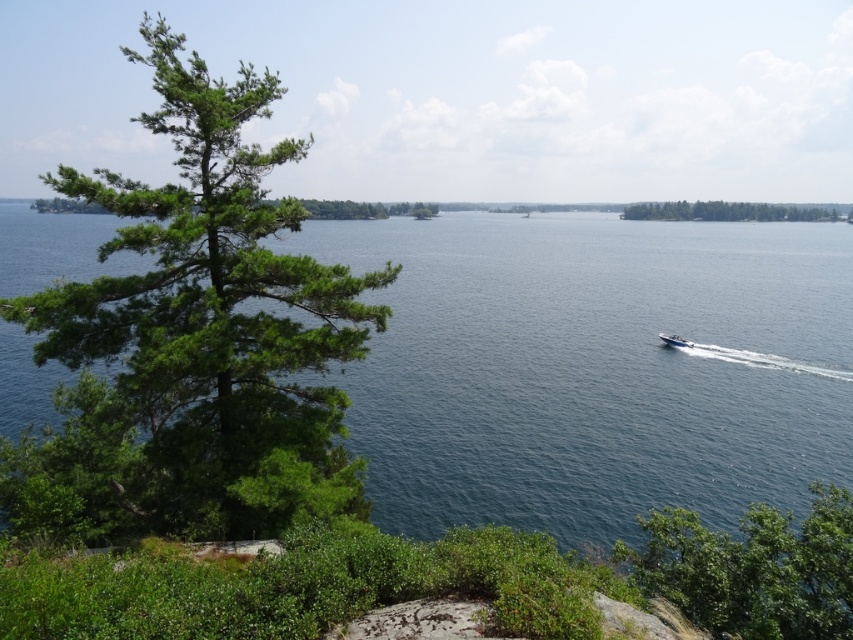
Question: Based on their relative distances, which object is nearer to the blue water at center?

Choices:
 (A) green leafy tree at upper right
 (B) green needle-like foliage at left
 (C) green leafy tree at lower right

Answer: (B)

Question: Is green needle-like foliage at left closer to camera compared to green leafy tree at lower right?

Choices:
 (A) no
 (B) yes

Answer: (A)

Question: Does green needle-like foliage at left have a smaller size compared to green leafy tree at upper right?

Choices:
 (A) yes
 (B) no

Answer: (A)

Question: Among these points, which one is nearest to the camera?

Choices:
 (A) (675, 564)
 (B) (746, 204)
 (C) (686, 344)

Answer: (A)

Question: Does blue water at center have a lesser width compared to green leafy tree at upper right?

Choices:
 (A) no
 (B) yes

Answer: (A)

Question: Which point is farther to the camera?

Choices:
 (A) (798, 218)
 (B) (155, 296)
 (C) (672, 340)
 (D) (338, 240)

Answer: (A)